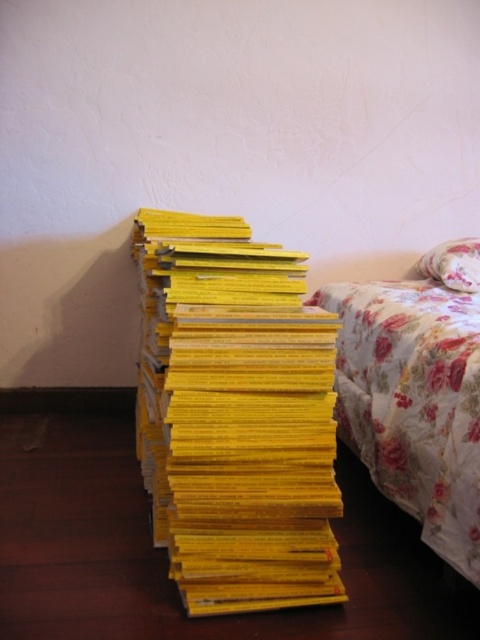
You are standing in the room corner where the yellow books are stacked against the wall. You see two points marked in the image. Which point, point (285,442) or point (477,237), is closer to you?

Point (285,442) is closer to you because it is in front of point (477,237).

You are standing in the room corner where the yellow matte book at center is located. If you walk straight ahead, will you immediately hit the bed to the right of the book?

The yellow matte book at center is positioned at point 0.652 on the x axis and 0.492 on the y axis. Since the bed is to the right of the book, walking straight ahead would mean moving along the y axis. The bed is located to the right along the x axis, so walking straight ahead would not immediately hit the bed. You would need to move to the right along the x axis to reach the bed.